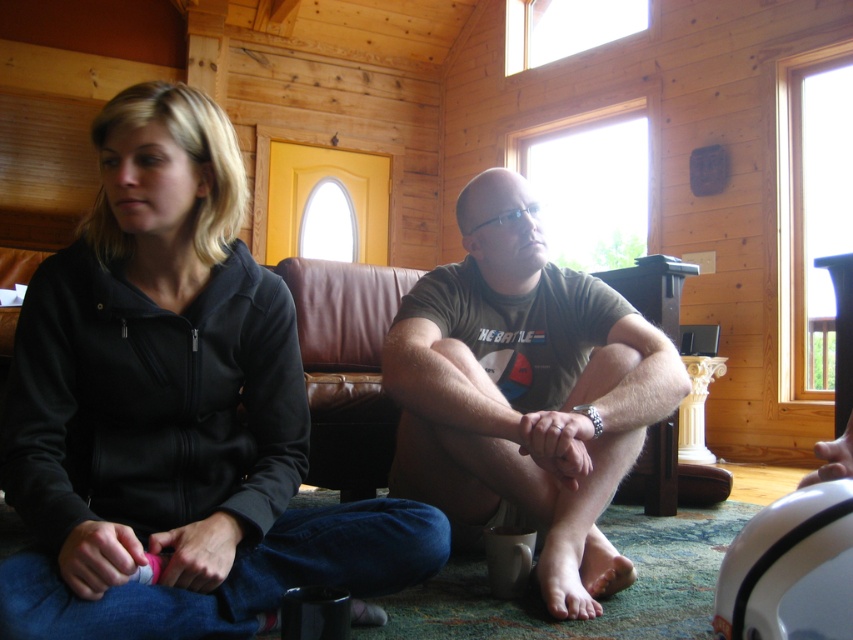
Question: Can you confirm if black fleece jacket at center is thinner than matte gray t-shirt at center?

Choices:
 (A) no
 (B) yes

Answer: (A)

Question: Among these objects, which one is farthest from the camera?

Choices:
 (A) matte gray t-shirt at center
 (B) black fleece jacket at center

Answer: (A)

Question: Does black fleece jacket at center appear on the right side of matte gray t-shirt at center?

Choices:
 (A) yes
 (B) no

Answer: (B)

Question: Among these points, which one is nearest to the camera?

Choices:
 (A) (213, 513)
 (B) (463, 224)

Answer: (A)

Question: In this image, where is black fleece jacket at center located relative to matte gray t-shirt at center?

Choices:
 (A) above
 (B) below

Answer: (A)